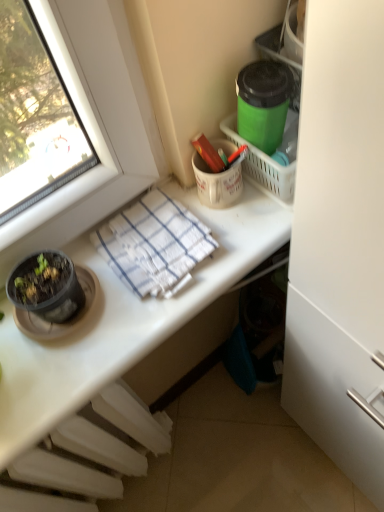
You are a GUI agent. You are given a task and a screenshot of the screen. Output one action in this format:
    pyautogui.click(x=<x>, y=<y>)
    Task: Click on the vacant space in white woven towel at center (from a real-world perspective)
    
    Given the screenshot: What is the action you would take?
    pyautogui.click(x=154, y=250)